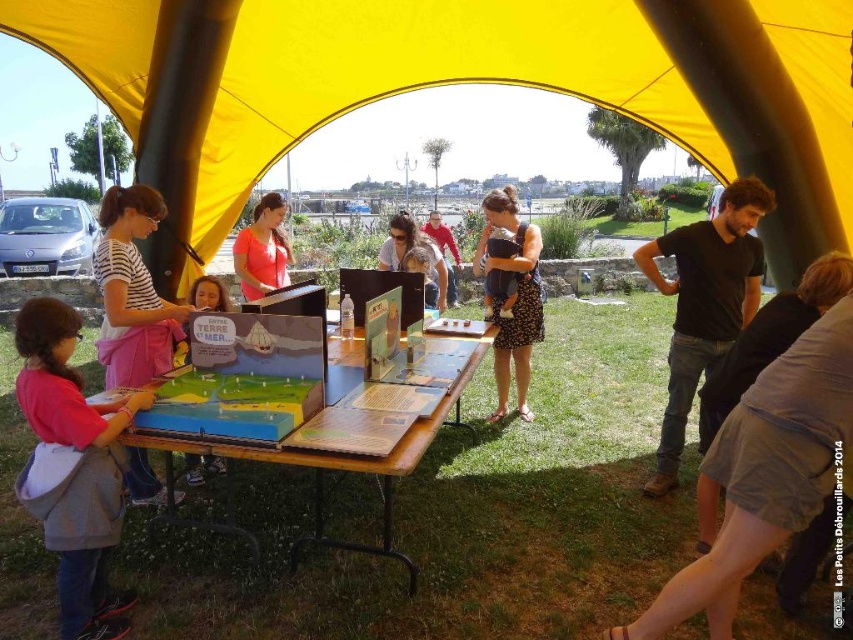
Consider the image. You are standing at the entrance of the large yellow tent and want to locate the pink fabric shirt at lower left. Based on the coordinates provided, in which direction should you look to find it?

The pink fabric shirt at lower left is located at coordinates point (73,468), which is in the lower left area of the image. Since you are at the entrance, you should look towards the lower left direction to find it.